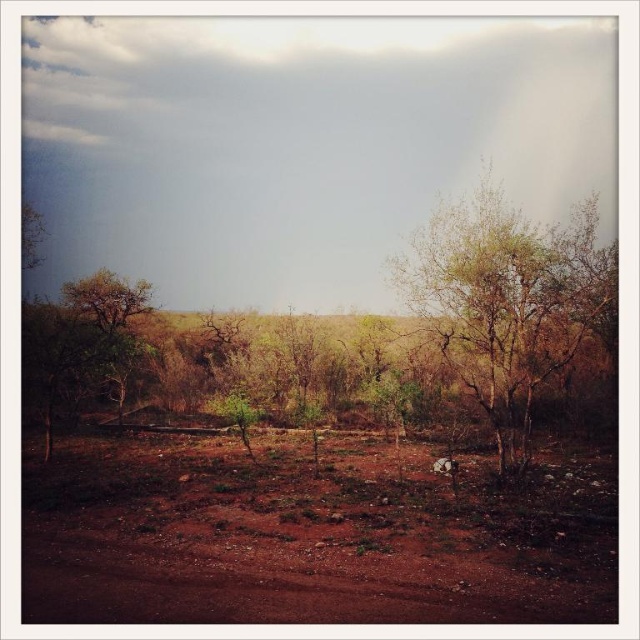
You are standing on the dirt road in the foreground of the scene. You see the brown soil at center and the green leafy tree at center. Which object is closer to the ground?

The brown soil at center is closer to the ground because it is shorter than the green leafy tree at center.

You are standing on the dirt road in the foreground of the scene. You see the brown soil at center and the green leafy tree at center. Which object is closer to you?

The brown soil at center is closer to you because it is in front of the green leafy tree at center.